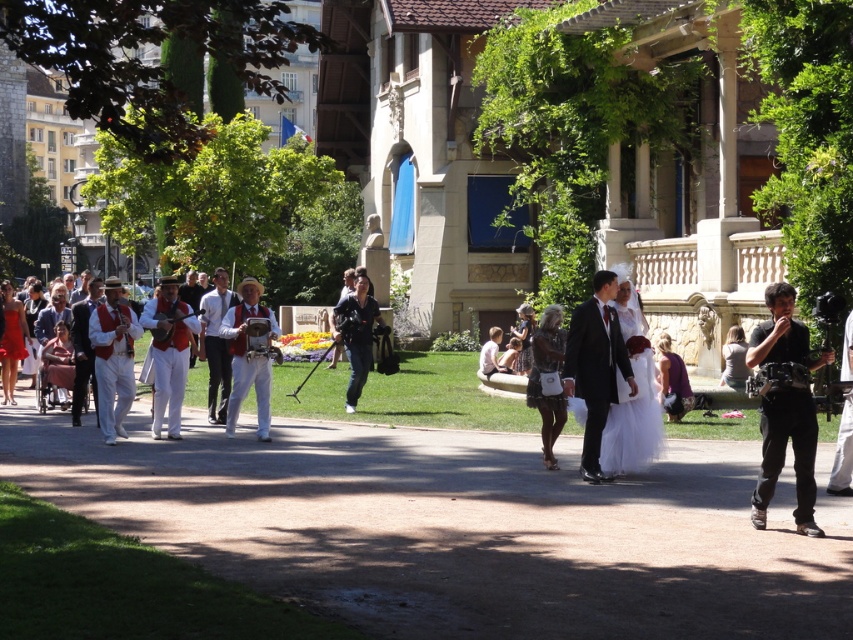
Question: From the image, what is the correct spatial relationship of brown gravel path at center in relation to matte red dress at lower left?

Choices:
 (A) left
 (B) right

Answer: (B)

Question: Which object is positioned closest to the matte pink dress at left?

Choices:
 (A) white cotton shirt at center
 (B) matte black dress at lower right

Answer: (A)

Question: Which object is closer to the camera taking this photo?

Choices:
 (A) white cotton pants at center
 (B) matte pink dress at left
 (C) white satin dress at center
 (D) matte white dress at center

Answer: (C)

Question: Does purple satin dress at center come in front of matte black dress at lower right?

Choices:
 (A) yes
 (B) no

Answer: (A)

Question: Is white cotton pants at left positioned behind matte black suit at center?

Choices:
 (A) yes
 (B) no

Answer: (B)

Question: Which of these objects is positioned farthest from the matte pink dress at left?

Choices:
 (A) black matte camera at right
 (B) white cotton pants at left
 (C) white satin dress at center

Answer: (A)